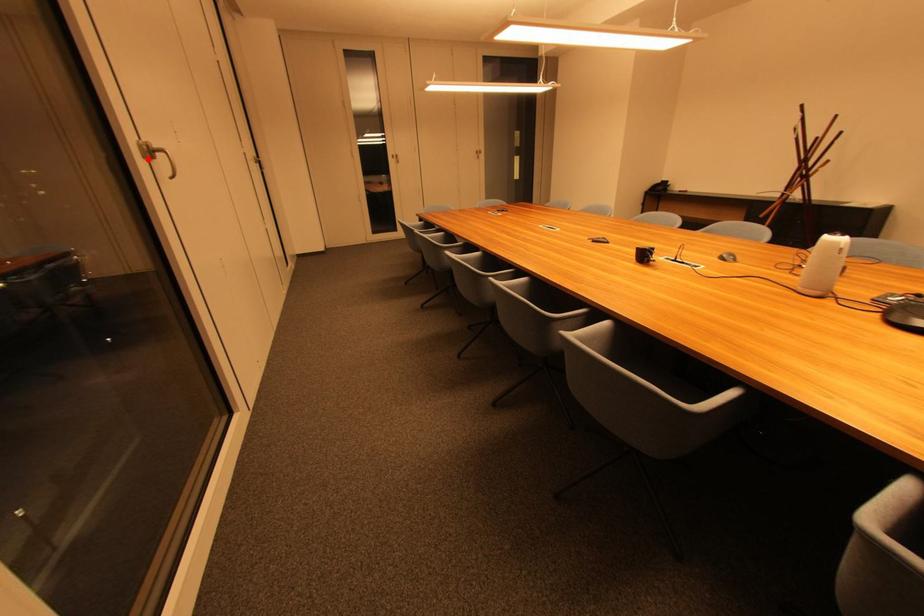
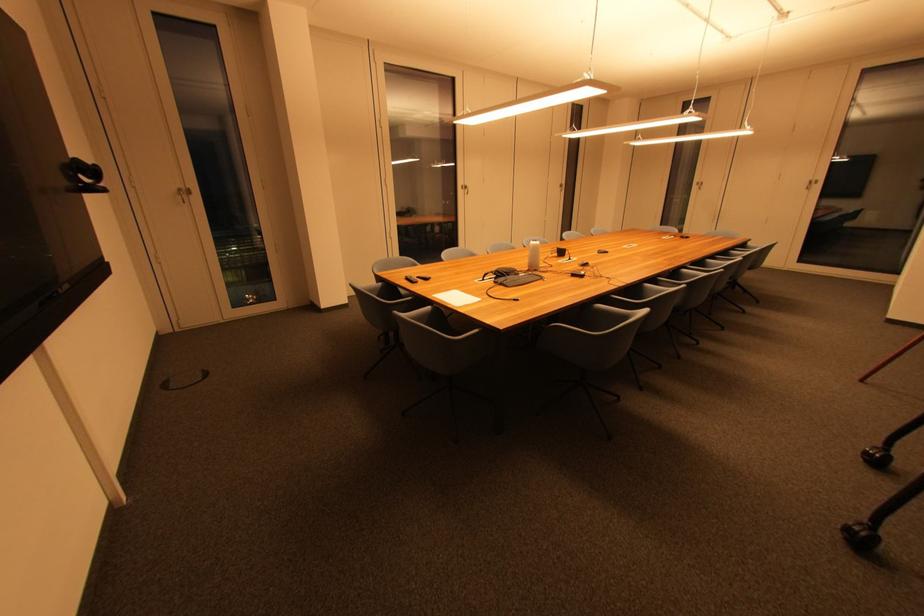
Locate, in the second image, the point that corresponds to the highlighted location in the first image.

(468, 190)